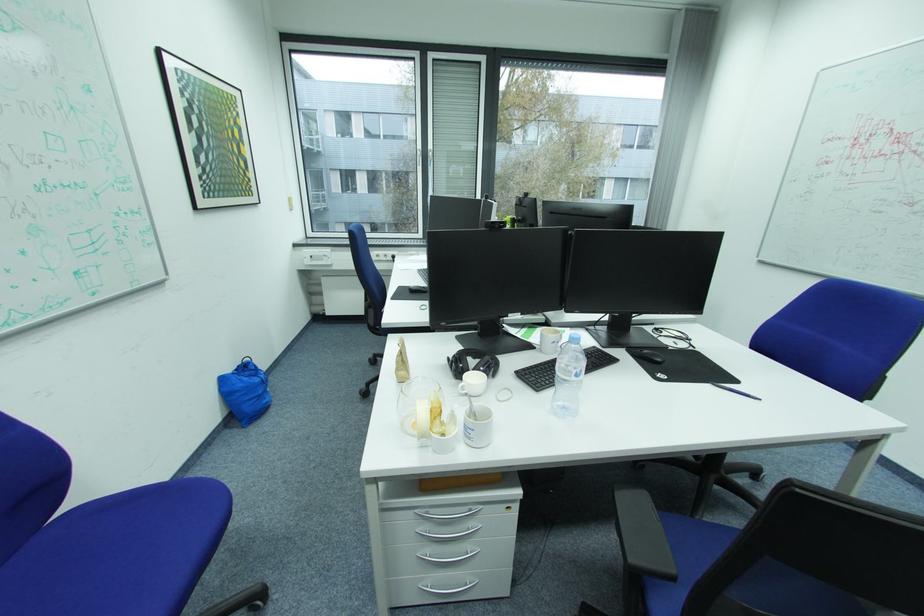
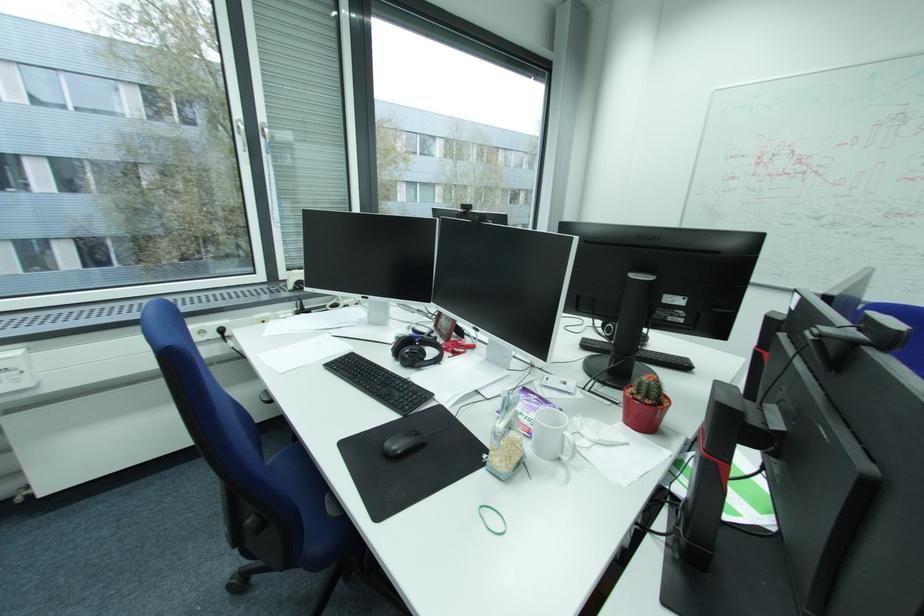
Find the pixel in the second image that matches point 428,150 in the first image.

(247, 121)